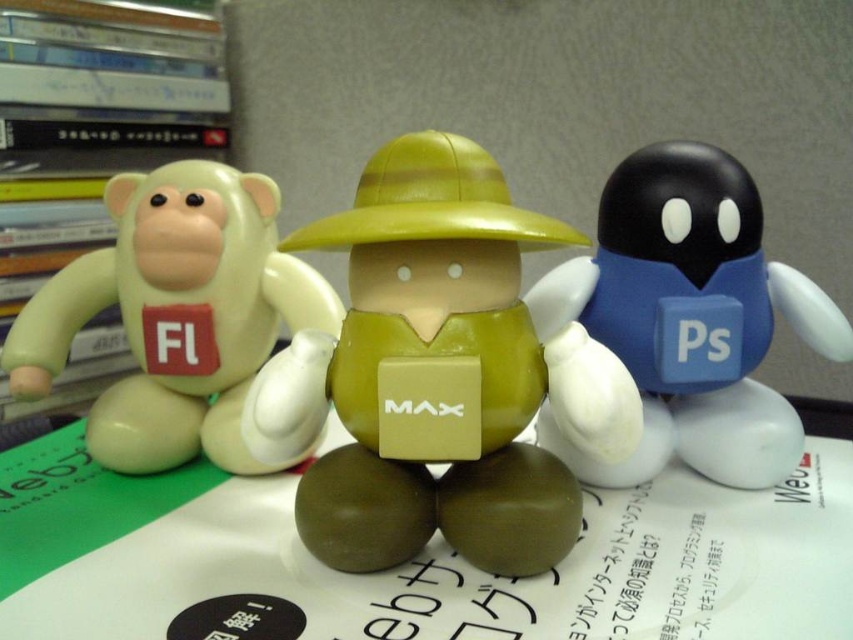
What is the color of the figure located at the coordinates point (451, 372)?

The figure at point (451, 372) is matte green.

Where is the matte green figure at center located in the image?

The matte green figure at center is located at point (451, 372).